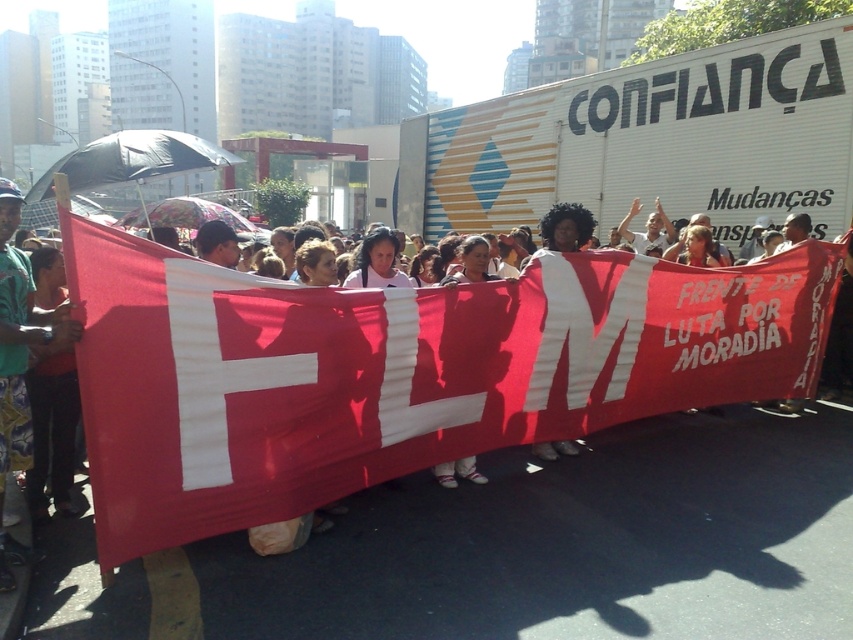
You are a photographer trying to capture the protest scene. You notice the red fabric banner at center and the green fabric shirt at center. Which object should you focus on if you want to photograph the taller one?

The red fabric banner at center is taller than the green fabric shirt at center, so you should focus on the red fabric banner at center.

You are a photographer at the protest scene. You want to capture a photo that includes both the red fabric banner at center and the green fabric shirt at center. Which object will occupy more horizontal space in the photo?

The red fabric banner at center has a greater width than the green fabric shirt at center, so it will occupy more horizontal space in the photo.

What is the 2D coordinate of the red fabric banner at center in the image?

The 2D coordinate of the red fabric banner at center is at point (396, 371).